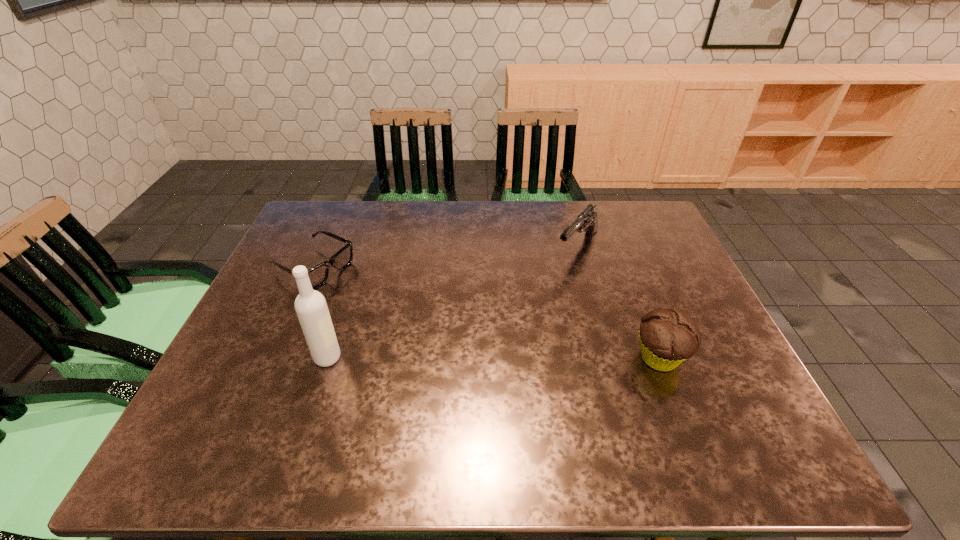
You are a GUI agent. You are given a task and a screenshot of the screen. Output one action in this format:
    pyautogui.click(x=<x>, y=<y>)
    Task: Click on the tallest object
    
    Given the screenshot: What is the action you would take?
    pyautogui.click(x=311, y=308)

Locate an element on the screen. The width and height of the screenshot is (960, 540). muffin is located at coordinates [x=668, y=337].

Identify the location of gun. Image resolution: width=960 pixels, height=540 pixels. (587, 221).

In order to click on sunglasses in this screenshot , I will do `click(318, 275)`.

The width and height of the screenshot is (960, 540). In order to click on free space located on the left of the tallest object in this screenshot , I will do `click(271, 357)`.

This screenshot has width=960, height=540. I want to click on blank space located on the back of the muffin, so click(x=618, y=252).

This screenshot has width=960, height=540. I want to click on free space located 0.380m at the end of the barrel of the gun, so click(x=492, y=347).

Find the location of a particular element. free location located 0.390m at the end of the barrel of the gun is located at coordinates (489, 350).

Image resolution: width=960 pixels, height=540 pixels. In order to click on free location located at the end of the barrel of the gun in this screenshot , I will do `click(527, 308)`.

The width and height of the screenshot is (960, 540). In order to click on vacant space situated 0.310m on the front-facing side of the shortest object in this screenshot , I will do click(429, 329).